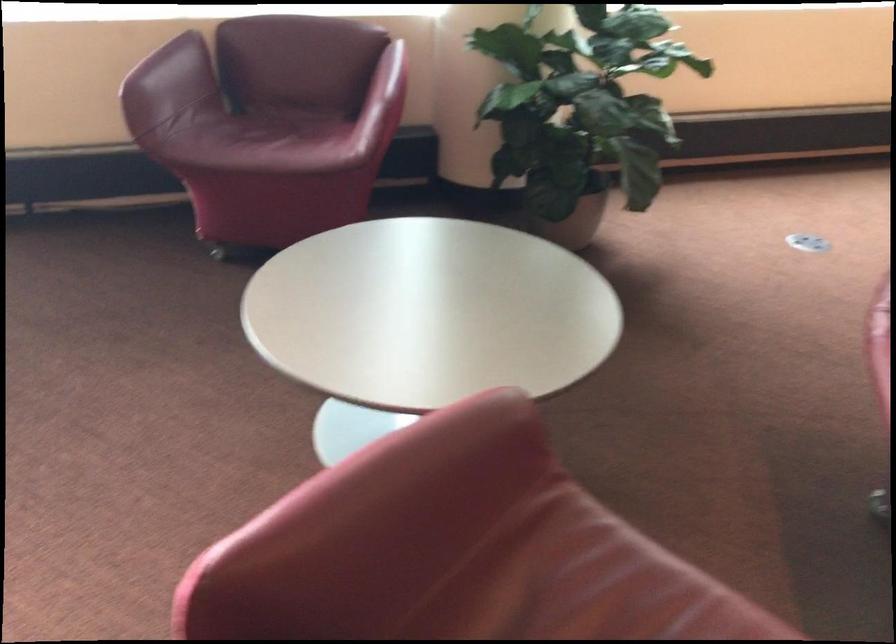
Locate an element on the screen. The height and width of the screenshot is (644, 896). red chair sitting surface is located at coordinates point(263,140).